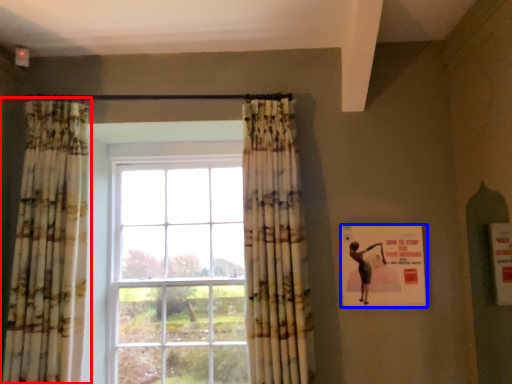
Question: Which of the following is the farthest to the observer, curtain (highlighted by a red box) or poster (highlighted by a blue box)?

Choices:
 (A) curtain
 (B) poster

Answer: (B)